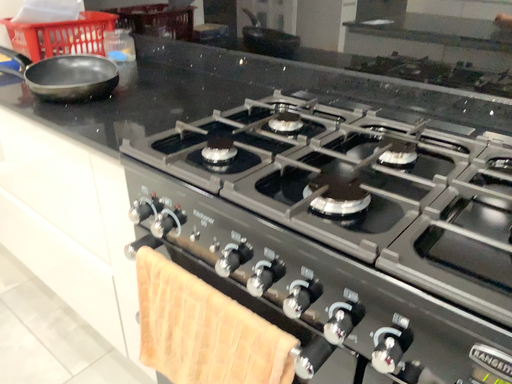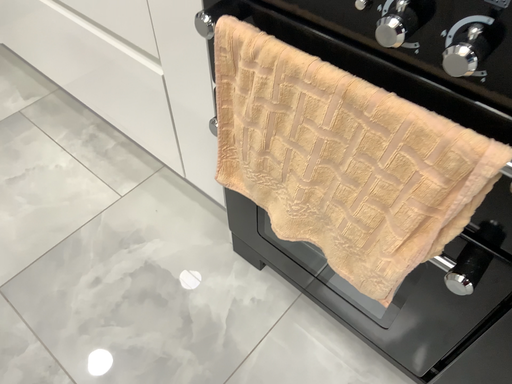
Question: Which way did the camera rotate in the video?

Choices:
 (A) rotated downward
 (B) rotated upward

Answer: (A)